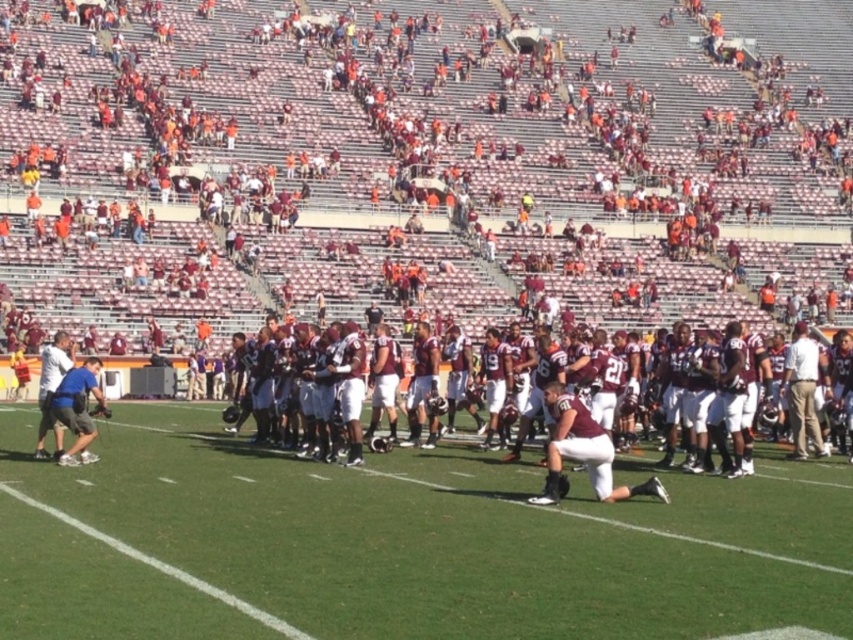
Which is in front, point (733, 566) or point (775, 465)?

Positioned in front is point (733, 566).

Who is taller, white smooth grass at center or maroon jersey at center?

With more height is maroon jersey at center.

Is point (833, 545) more distant than point (782, 465)?

No, it is not.

The width and height of the screenshot is (853, 640). I want to click on white smooth grass at center, so click(x=399, y=545).